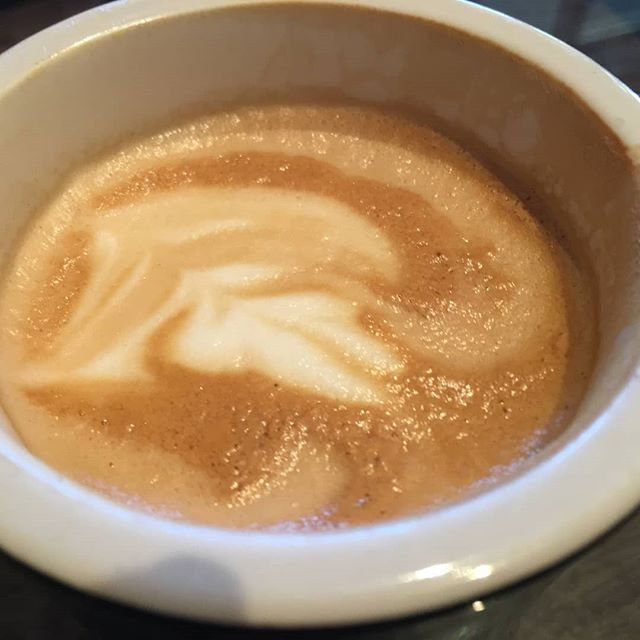
Locate an element on the screen. The width and height of the screenshot is (640, 640). mug is located at coordinates (308, 573).